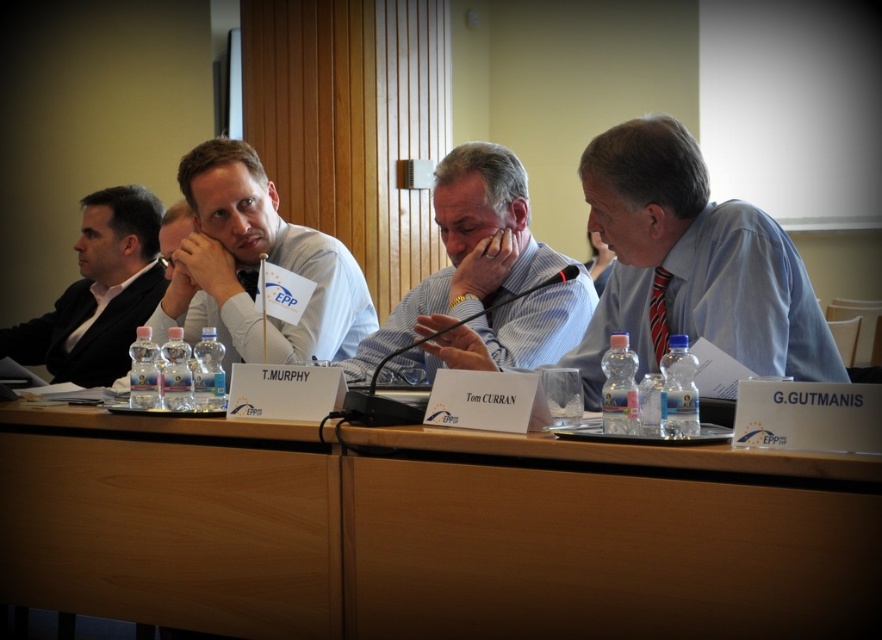
Consider the image. You are sitting at the back of the conference room and want to hand a document to both the white shirt at center and the blue striped shirt at center. Which one should you approach first based on their positions?

You should approach the white shirt at center first because it is closer to you than the blue striped shirt at center, which is further away.

You are sitting at the conference table and want to pass a document to the person in the blue striped shirt at center without disturbing the person in the white shirt at center. Which direction should you pass the document?

The white shirt at center is to the left of blue striped shirt at center, so you should pass the document to the right to reach the blue striped shirt at center without disturbing the white shirt at center.

Consider the image. You are a person sitting at the conference table. You want to reach the point at coordinates point (203, 273) and point (496, 294). Which point is closer to you?

Point (203, 273) is closer to you because it is further to the viewer than point (496, 294).